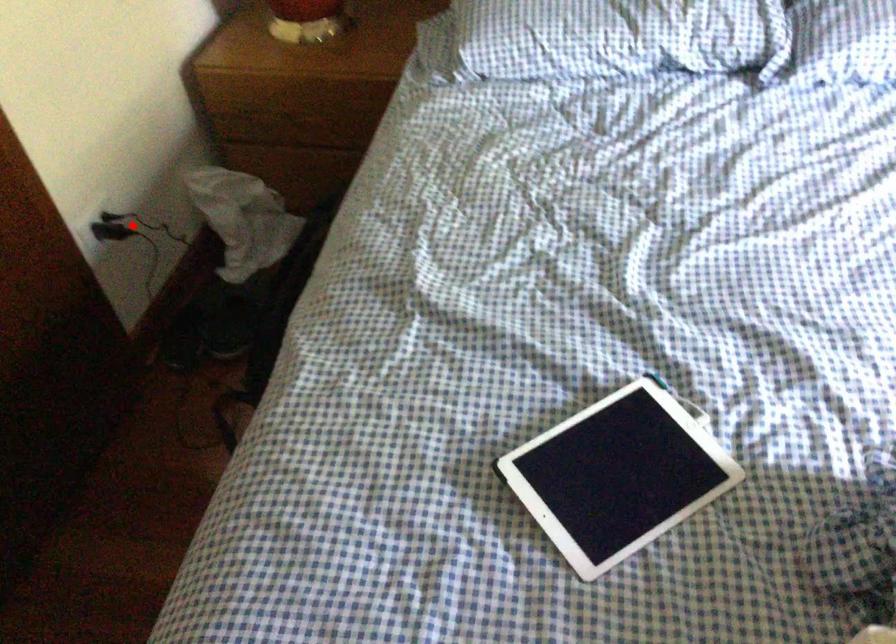
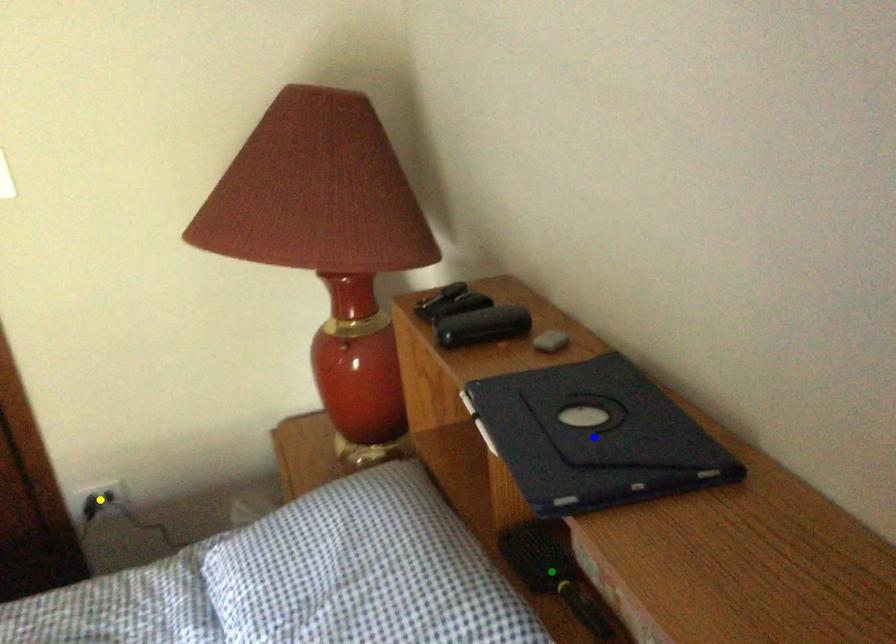
Question: I am providing you with two images of the same scene from different viewpoints. A red point is marked on the first image. You are given multiple points on the second image. Which mark in image 2 goes with the point in image 1?

Choices:
 (A) blue point
 (B) yellow point
 (C) green point

Answer: (B)